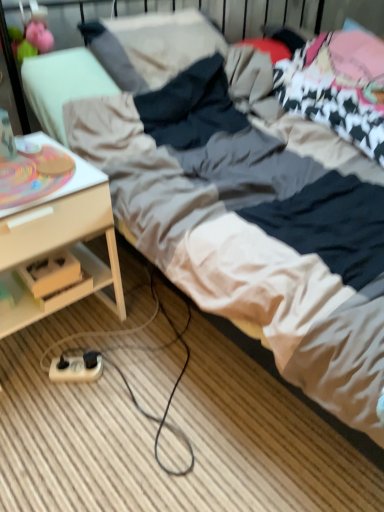
In order to click on vacant area to the right of beige plastic extension cord at lower left in this screenshot , I will do `click(134, 374)`.